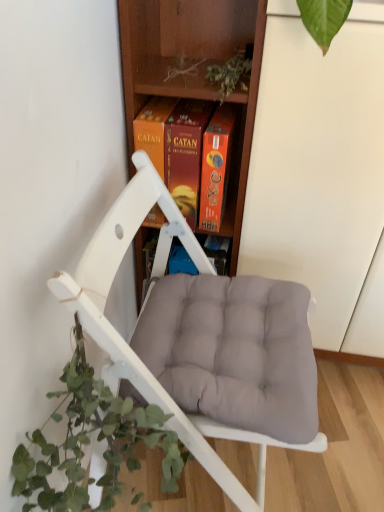
Question: Is white matte chair at center in front of green leafy plant at lower left?

Choices:
 (A) no
 (B) yes

Answer: (A)

Question: Can you confirm if white matte chair at center is smaller than green leafy plant at lower left?

Choices:
 (A) yes
 (B) no

Answer: (B)

Question: Is the position of white matte chair at center more distant than that of green leafy plant at lower left?

Choices:
 (A) no
 (B) yes

Answer: (B)

Question: Considering the relative sizes of white matte chair at center and green leafy plant at lower left in the image provided, is white matte chair at center shorter than green leafy plant at lower left?

Choices:
 (A) no
 (B) yes

Answer: (A)

Question: From the image's perspective, is white matte chair at center beneath green leafy plant at lower left?

Choices:
 (A) yes
 (B) no

Answer: (B)

Question: Is green leafy plant at lower left bigger or smaller than white matte chair at center?

Choices:
 (A) big
 (B) small

Answer: (B)

Question: From a real-world perspective, is green leafy plant at lower left above or below white matte chair at center?

Choices:
 (A) above
 (B) below

Answer: (B)

Question: In the image, is green leafy plant at lower left on the left side or the right side of white matte chair at center?

Choices:
 (A) left
 (B) right

Answer: (A)

Question: Is green leafy plant at lower left in front of or behind white matte chair at center in the image?

Choices:
 (A) front
 (B) behind

Answer: (A)

Question: In terms of height, does white matte chair at center look taller or shorter compared to green leafy plant at lower left?

Choices:
 (A) tall
 (B) short

Answer: (A)

Question: Considering the positions of white matte chair at center and green leafy plant at lower left in the image, is white matte chair at center wider or thinner than green leafy plant at lower left?

Choices:
 (A) thin
 (B) wide

Answer: (B)

Question: Is white matte chair at center situated inside green leafy plant at lower left or outside?

Choices:
 (A) outside
 (B) inside

Answer: (A)

Question: From a real-world perspective, is white matte chair at center positioned above or below green leafy plant at lower left?

Choices:
 (A) above
 (B) below

Answer: (A)

Question: Relative to green leafy plant at lower left, is wooden at center in front or behind?

Choices:
 (A) behind
 (B) front

Answer: (A)

Question: Considering the positions of point (208, 26) and point (79, 417), is point (208, 26) closer or farther from the camera than point (79, 417)?

Choices:
 (A) farther
 (B) closer

Answer: (A)